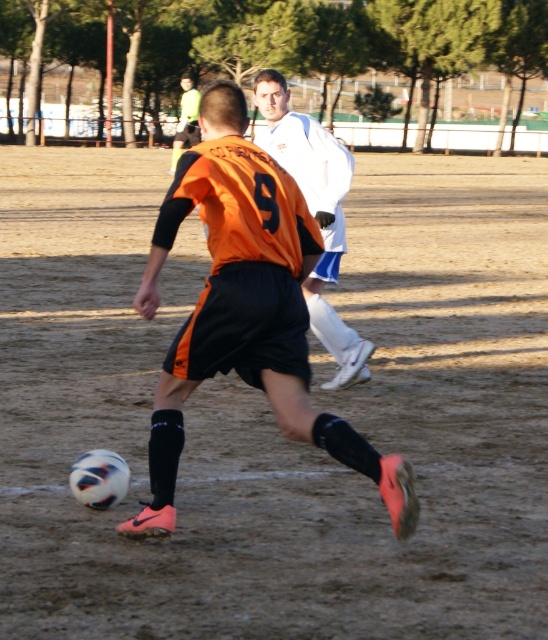
Measure the distance from white matte jacket at upper center to orange jersey at center.

white matte jacket at upper center and orange jersey at center are 82.00 feet apart.

Looking at this image, between white matte jacket at upper center and orange jersey at center, which one appears on the left side from the viewer's perspective?

orange jersey at center is more to the left.

Locate an element on the screen. The image size is (548, 640). white matte jacket at upper center is located at coordinates (316, 212).

Does orange matte jersey at center appear on the left side of orange jersey at center?

In fact, orange matte jersey at center is to the right of orange jersey at center.

The image size is (548, 640). What do you see at coordinates (246, 308) in the screenshot?
I see `orange matte jersey at center` at bounding box center [246, 308].

I want to click on orange matte jersey at center, so click(246, 308).

The width and height of the screenshot is (548, 640). I want to click on orange matte jersey at center, so click(246, 308).

Between point (193, 182) and point (321, 164), which one is positioned in front?

Point (193, 182) is more forward.

Is point (220, 141) behind point (342, 364)?

No, (220, 141) is closer to viewer.

You are a GUI agent. You are given a task and a screenshot of the screen. Output one action in this format:
    pyautogui.click(x=<x>, y=<y>)
    Task: Click on the orange matte jersey at center
    This screenshot has height=640, width=548.
    Given the screenshot: What is the action you would take?
    pyautogui.click(x=246, y=308)